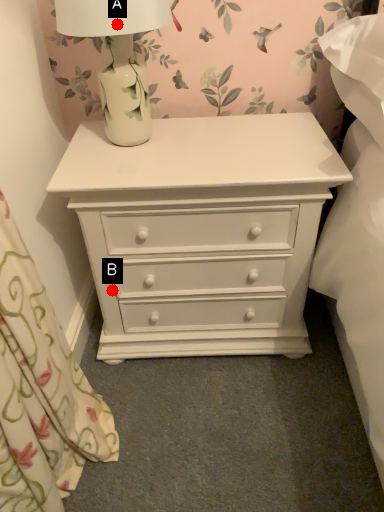
Question: Two points are circled on the image, labeled by A and B beside each circle. Which point is further to the camera?

Choices:
 (A) A is further
 (B) B is further

Answer: (B)